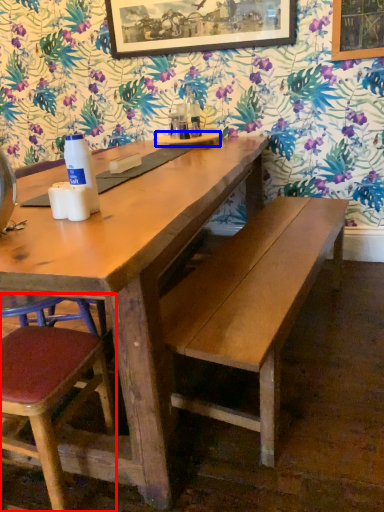
Question: Which point is further to the camera, chair (highlighted by a red box) or plate (highlighted by a blue box)?

Choices:
 (A) chair
 (B) plate

Answer: (B)